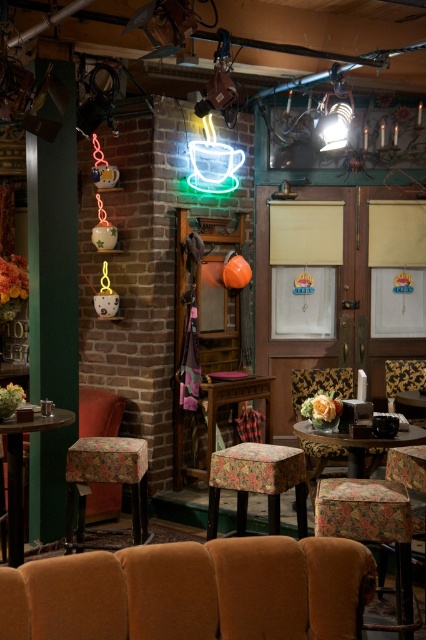
You are standing at the entrance of the vintage cafe and want to sit down. Where is the floral fabric bar stool at lower right located in the cafe?

The floral fabric bar stool at lower right is located at the coordinates 0.823 on the x axis and 0.873 on the y axis.

You are standing in the center of the room and want to sit down in the velvet orange armchair at lower center. According to the coordinates provided, in which direction should you move relative to your current position?

The velvet orange armchair at lower center is located at coordinates point (x=190, y=592). Since you are standing at the center of the room, you should move towards the lower center direction to reach the velvet orange armchair at lower center.